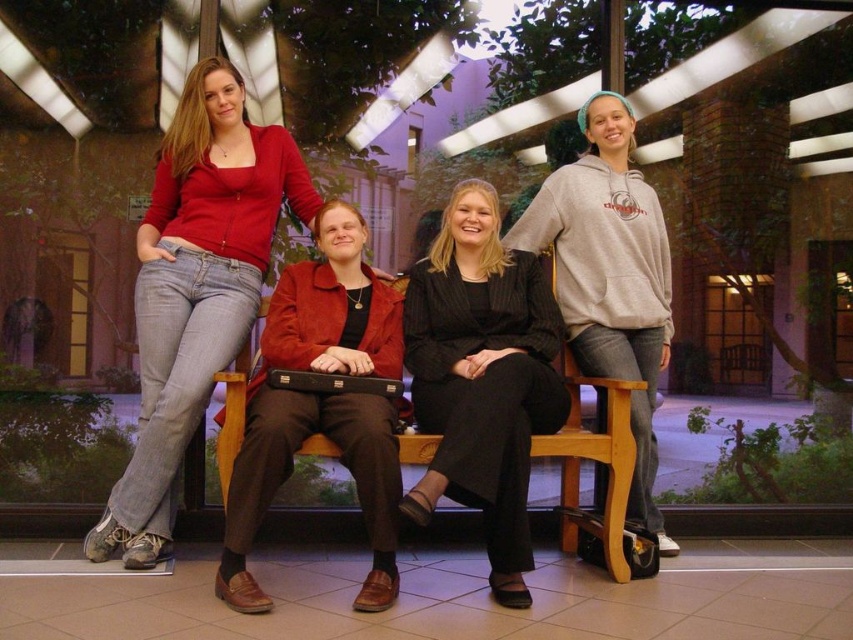
Question: Observing the image, what is the correct spatial positioning of black pinstripe blazer at center in reference to gray hoodie at center?

Choices:
 (A) left
 (B) right

Answer: (A)

Question: Which object appears farthest from the camera in this image?

Choices:
 (A) matte black briefcase at center
 (B) black pinstripe blazer at center
 (C) black leather briefcase at center
 (D) wooden bench at center

Answer: (A)

Question: Can you confirm if black pinstripe blazer at center is bigger than gray hoodie at center?

Choices:
 (A) no
 (B) yes

Answer: (B)

Question: Is matte black briefcase at center to the right of wooden bench at center from the viewer's perspective?

Choices:
 (A) yes
 (B) no

Answer: (B)

Question: Which point is closer to the camera?

Choices:
 (A) gray hoodie at center
 (B) leather jacket at center

Answer: (B)

Question: Which object appears farthest from the camera in this image?

Choices:
 (A) wooden bench at center
 (B) black pinstripe blazer at center

Answer: (A)